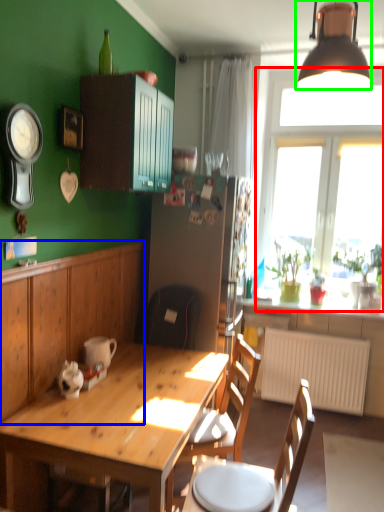
Question: Which object is positioned farthest from window (highlighted by a red box)? Select from cabinetry (highlighted by a blue box) and lamp (highlighted by a green box).

Choices:
 (A) cabinetry
 (B) lamp

Answer: (A)